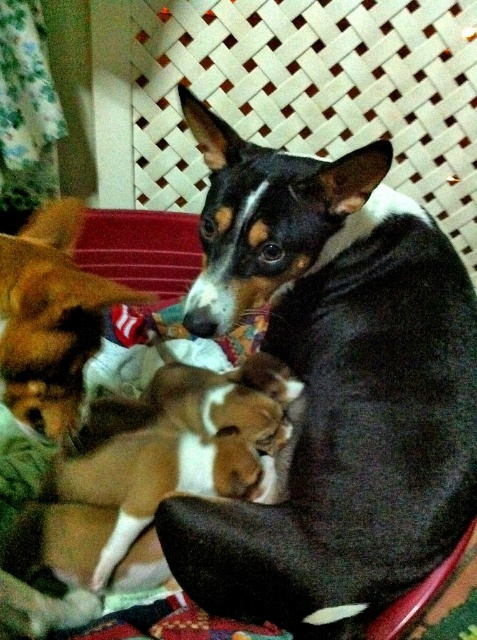
You are a photographer trying to capture both dogs in a single frame. Given that your camera can only focus on objects wider than 30 cm, will both the black and white fur dog at center and the brown soft fur at lower left fit within the focus range?

The black and white fur dog at center is wider than the brown soft fur at lower left. Since the camera requires objects wider than 30 cm to focus, we need to check if both meet this. However, the exact widths aren

You are looking at two dogs resting on a red cushion. The dogs are the brown and white fur at center and the brown soft fur at lower left. Which dog is located to the right of the other?

The brown and white fur at center is positioned on the right side of brown soft fur at lower left.

You are a pet sitter observing two dogs on a red cushioned surface. You notice the brown and white fur at center and the brown soft fur at lower left. Which dog is lying on top of the other?

The brown soft fur at lower left is lying on top of the brown and white fur at center because the brown and white fur at center is positioned under it.